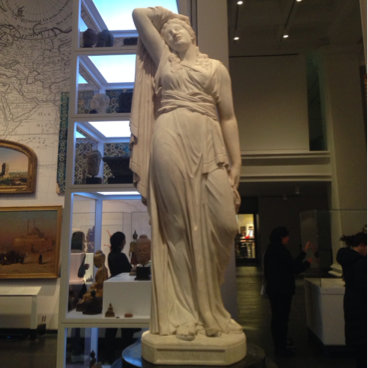
Locate an element on the screen. The image size is (368, 368). statue is located at coordinates (203, 206).